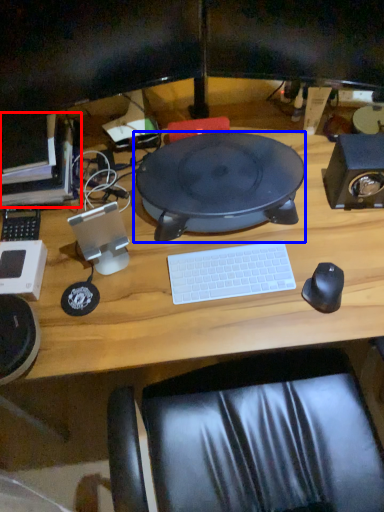
Question: Among these objects, which one is nearest to the camera, computer (highlighted by a red box) or sit (highlighted by a blue box)?

Choices:
 (A) computer
 (B) sit

Answer: (B)